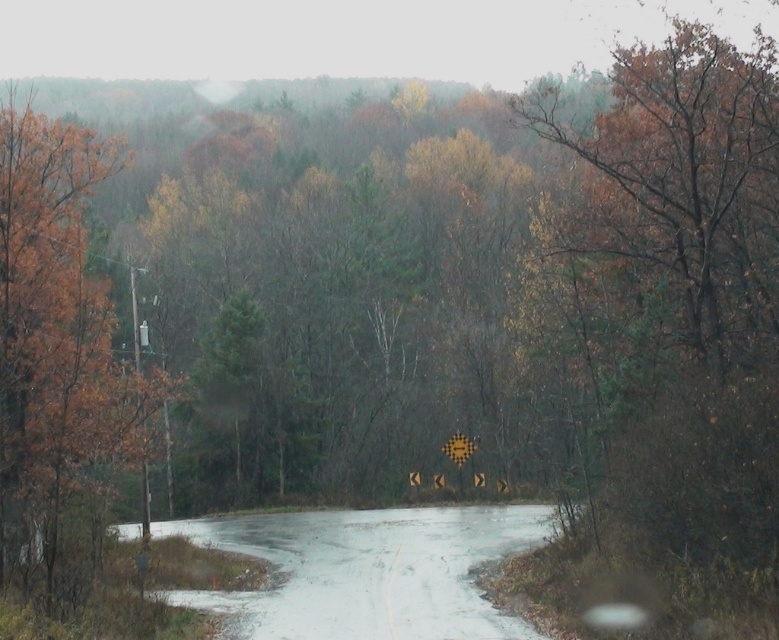
Question: Which point appears farthest from the camera in this image?

Choices:
 (A) (510, 516)
 (B) (83, 253)

Answer: (A)

Question: Is orange-brown bark tree at left thinner than white matte flood at center?

Choices:
 (A) no
 (B) yes

Answer: (A)

Question: Which object is farther from the camera taking this photo?

Choices:
 (A) orange-brown bark tree at left
 (B) white matte flood at center

Answer: (B)

Question: Is orange-brown bark tree at left below white matte flood at center?

Choices:
 (A) no
 (B) yes

Answer: (A)

Question: Does orange-brown bark tree at left appear under white matte flood at center?

Choices:
 (A) yes
 (B) no

Answer: (B)